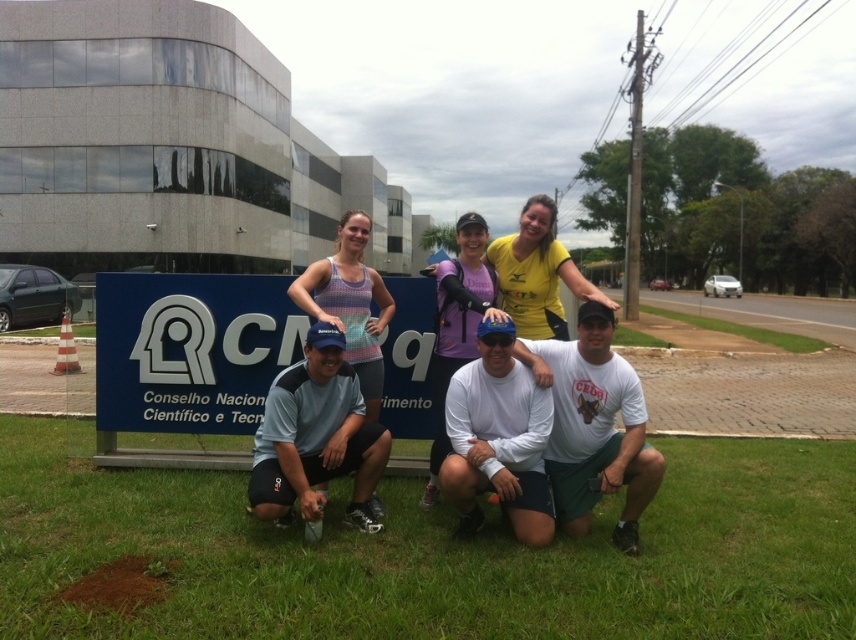
Question: Among these points, which one is nearest to the camera?

Choices:
 (A) (286, 520)
 (B) (70, 620)

Answer: (B)

Question: Is green grass at lower center to the left of blue fabric cap at center from the viewer's perspective?

Choices:
 (A) no
 (B) yes

Answer: (A)

Question: Can you confirm if green grass at lower center is wider than blue fabric cap at center?

Choices:
 (A) yes
 (B) no

Answer: (A)

Question: Which point is farther to the camera?

Choices:
 (A) coord(379,525)
 (B) coord(539,550)

Answer: (A)

Question: Can you confirm if green grass at lower center is thinner than blue fabric cap at center?

Choices:
 (A) yes
 (B) no

Answer: (B)